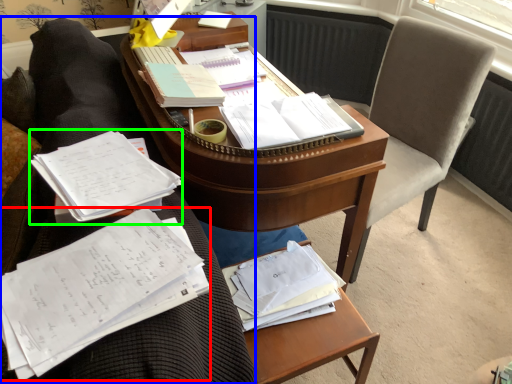
Question: Based on their relative distances, which object is nearer to document (highlighted by a red box)? Choose from furniture (highlighted by a blue box) and book (highlighted by a green box).

Choices:
 (A) furniture
 (B) book

Answer: (B)